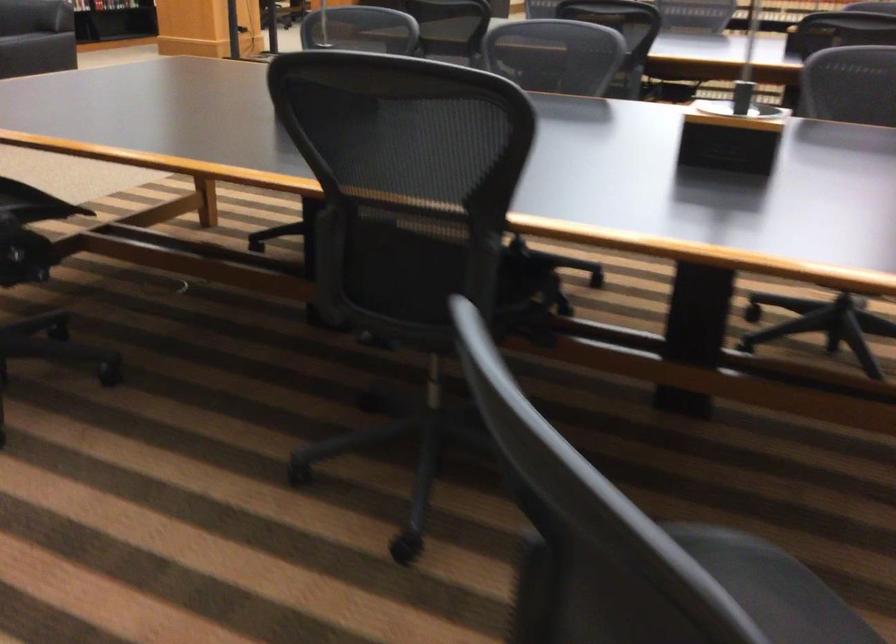
I want to click on black chair armrest, so click(530, 277).